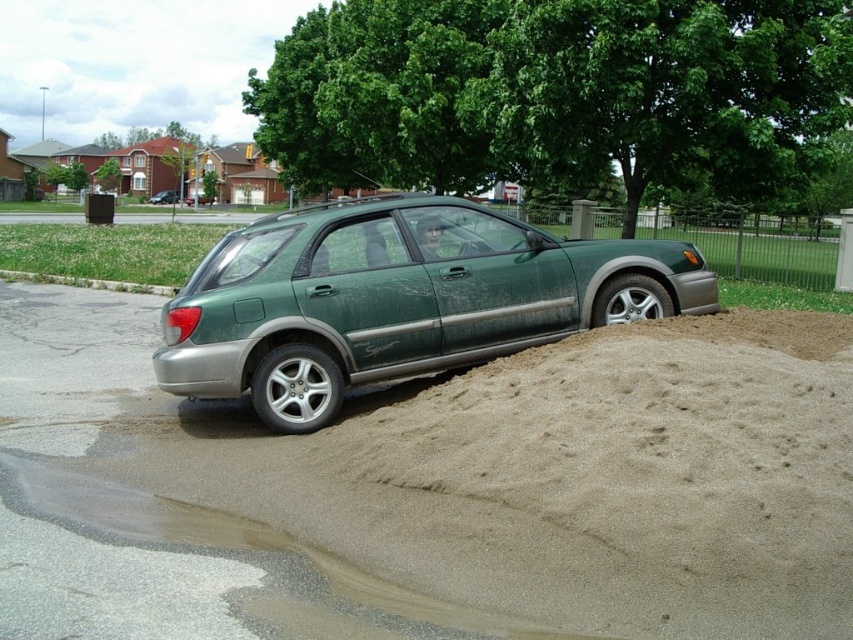
You are standing at the point labeled point (x=398, y=300) in the image. What object are you directly facing?

The point labeled point (x=398, y=300) corresponds to the green matte car at center, so you are directly facing the green matte car at center.

You are a delivery person trying to park your van in the driveway. You see the point marked at coordinates (398, 300) which is part of the green matte car at center. Is the car blocking the driveway?

The point at coordinates (398, 300) indicates the green matte car at center is blocking the driveway since it is parked there.

You are a delivery person trying to park your van next to the green matte car at center and the gray concrete curb at lower left. Based on their sizes, which object would require more space to maneuver around?

The green matte car at center requires more space to maneuver around since it is bigger than the gray concrete curb at lower left.